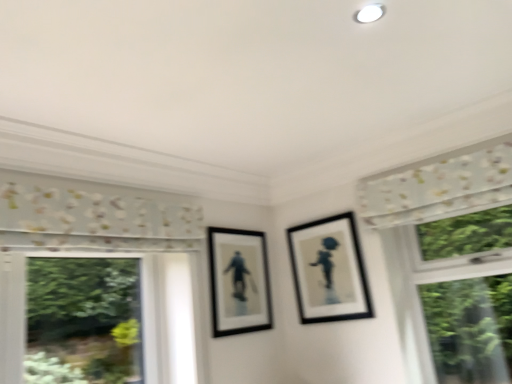
Question: From a real-world perspective, is white floral fabric at upper right physically located above or below matte black picture frame at center, which ranks as the 1th picture frame in left-to-right order?

Choices:
 (A) below
 (B) above

Answer: (B)

Question: Looking at their shapes, would you say white floral fabric at upper right is wider or thinner than matte black picture frame at center, which ranks as the 1th picture frame in left-to-right order?

Choices:
 (A) thin
 (B) wide

Answer: (B)

Question: Based on their relative distances, which object is nearer to the matte black picture frame at center, which ranks as the 1th picture frame in left-to-right order?

Choices:
 (A) white floral fabric at upper right
 (B) black matte picture frame at upper right, which is counted as the first picture frame, starting from the right

Answer: (B)

Question: Estimate the real-world distances between objects in this image. Which object is farther from the white floral fabric at upper right?

Choices:
 (A) matte black picture frame at center, which ranks as the 1th picture frame in left-to-right order
 (B) black matte picture frame at upper right, which is counted as the first picture frame, starting from the right

Answer: (A)